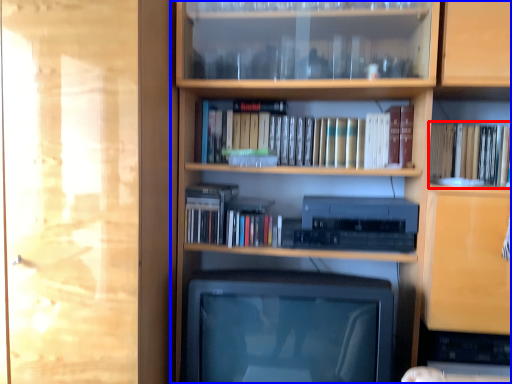
Question: Which point is closer to the camera, book (highlighted by a red box) or bookcase (highlighted by a blue box)?

Choices:
 (A) book
 (B) bookcase

Answer: (B)